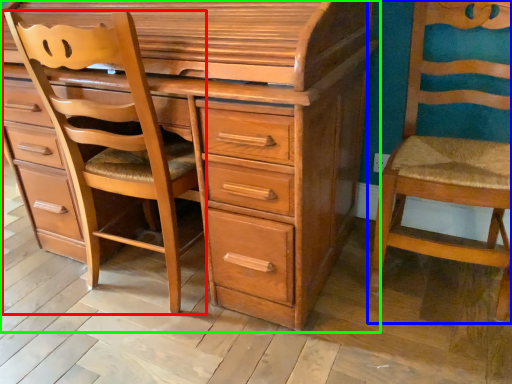
Question: Which object is the farthest from furniture (highlighted by a red box)? Choose among these: chair (highlighted by a blue box) or chest of drawers (highlighted by a green box).

Choices:
 (A) chair
 (B) chest of drawers

Answer: (A)